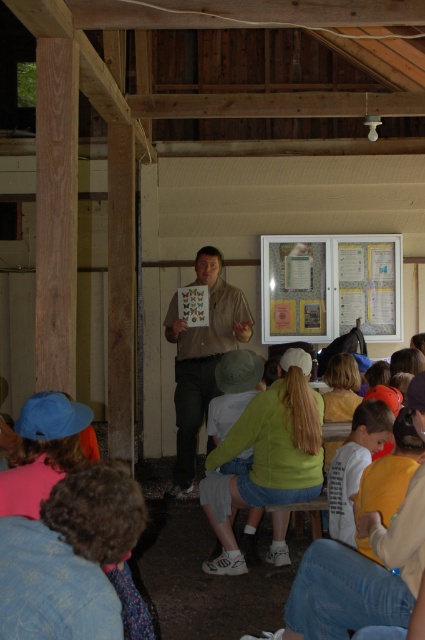
Question: Among these objects, which one is farthest from the camera?

Choices:
 (A) matte yellow paper at center
 (B) white cotton shirt at lower right
 (C) matte khaki shirt at center

Answer: (A)

Question: Considering the real-world distances, which object is farthest from the matte khaki shirt at center?

Choices:
 (A) matte yellow paper at center
 (B) white cotton shirt at lower right

Answer: (B)

Question: Which point appears farthest from the camera in this image?

Choices:
 (A) (198, 428)
 (B) (342, 241)
 (C) (340, 532)

Answer: (B)

Question: Observing the image, what is the correct spatial positioning of matte yellow paper at center in reference to matte khaki shirt at center?

Choices:
 (A) right
 (B) left

Answer: (A)

Question: Is the position of matte yellow paper at center more distant than that of matte khaki shirt at center?

Choices:
 (A) no
 (B) yes

Answer: (B)

Question: Is matte yellow paper at center thinner than matte khaki shirt at center?

Choices:
 (A) yes
 (B) no

Answer: (B)